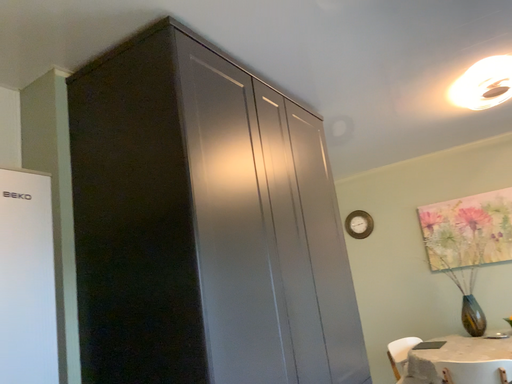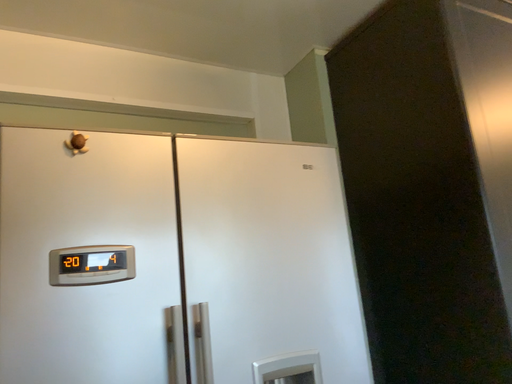
Question: How did the camera likely rotate when shooting the video?

Choices:
 (A) rotated right
 (B) rotated left

Answer: (B)